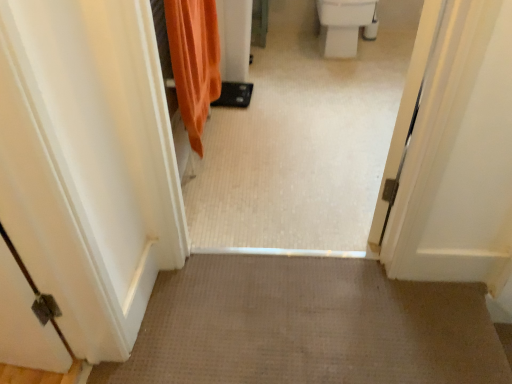
Question: Choose the correct answer: Is white glossy tile floor at center inside white glossy toilet bowl at upper right or outside it?

Choices:
 (A) outside
 (B) inside

Answer: (A)

Question: Based on their sizes in the image, would you say white glossy tile floor at center is bigger or smaller than white glossy toilet bowl at upper right?

Choices:
 (A) big
 (B) small

Answer: (A)

Question: Which of these objects is positioned closest to the orange fabric shower curtain at upper left?

Choices:
 (A) white glossy toilet bowl at upper right
 (B) white glossy tile floor at center

Answer: (B)

Question: Which of these objects is positioned closest to the white glossy toilet bowl at upper right?

Choices:
 (A) orange fabric shower curtain at upper left
 (B) white glossy tile floor at center

Answer: (B)